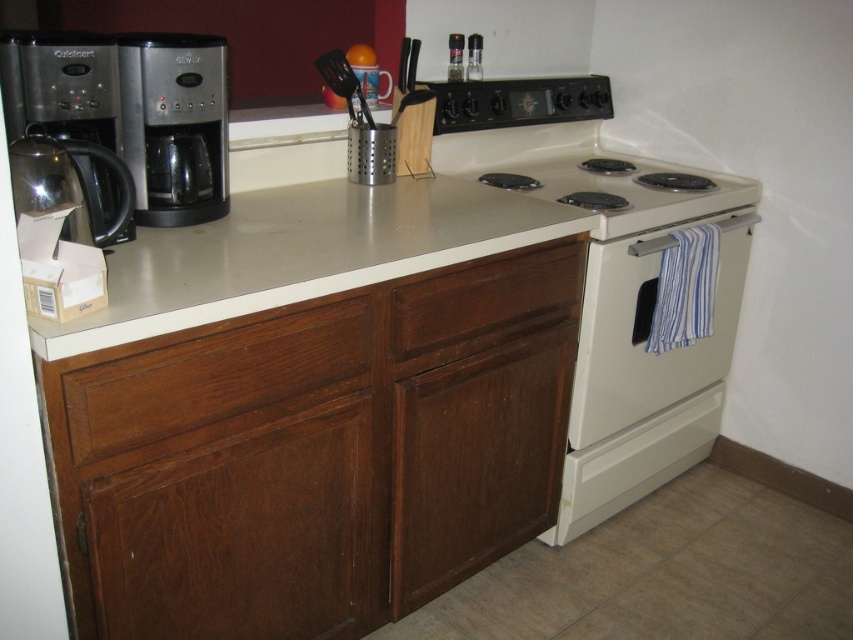
You are a chef preparing to place a large baking tray on the counter between the white glossy oven at center and the sleek metallic coffee maker at left. Based on their positions, can you determine if the tray will fit horizontally between them?

The white glossy oven at center is below the sleek metallic coffee maker at left, meaning they are vertically aligned. Since the oven is lower, there is enough horizontal space between them to place the baking tray.

Looking at this image, you are a chef preparing to place a large pot on the counter between the white glossy oven at center and the sleek metallic coffee maker at left. Based on their positions, which appliance should you move to make space?

The white glossy oven at center is to the right of the sleek metallic coffee maker at left, so you should move the white glossy oven at center to the right to create space between them.

You are standing in the kitchen and need to reach the wooden drawer at lower left. The point you are currently at is point [213,378]. Is this point the location of the wooden drawer at lower left?

Yes, the point [213,378] corresponds to the wooden drawer at lower left, so this is the location of the wooden drawer at lower left.